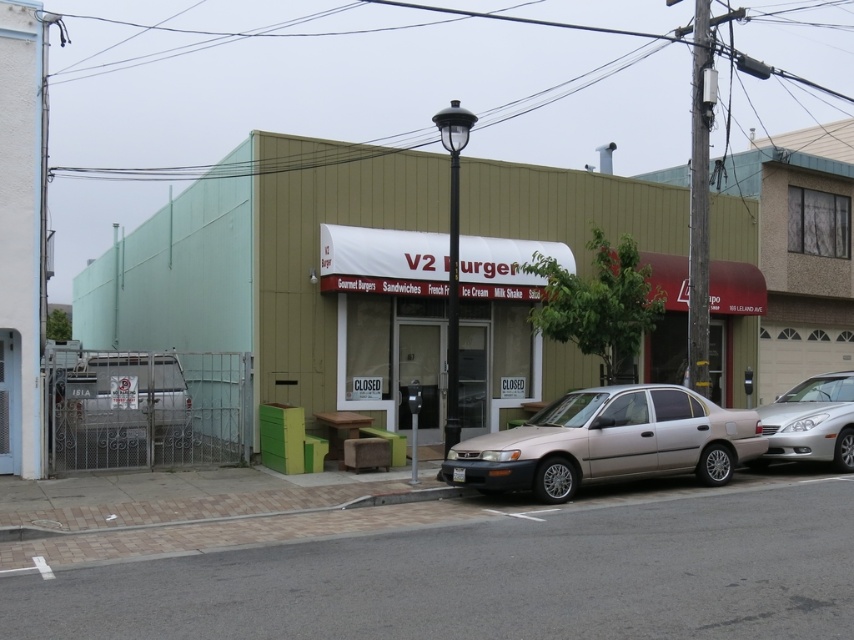
You are driving a car and see the satin beige sedan at center and the metallic silver van at lower left. Which vehicle is parked more to the right side of the road?

The satin beige sedan at center is parked more to the right side of the road than the metallic silver van at lower left.

You are driving a silver metallic sedan at right and want to park it perpendicular to the beige textured building at center. Is there enough space between the building and the lamppost to park the sedan?

The beige textured building at center might be wider than silver metallic sedan at right, so there may not be enough space between the building and the lamppost to park the sedan.